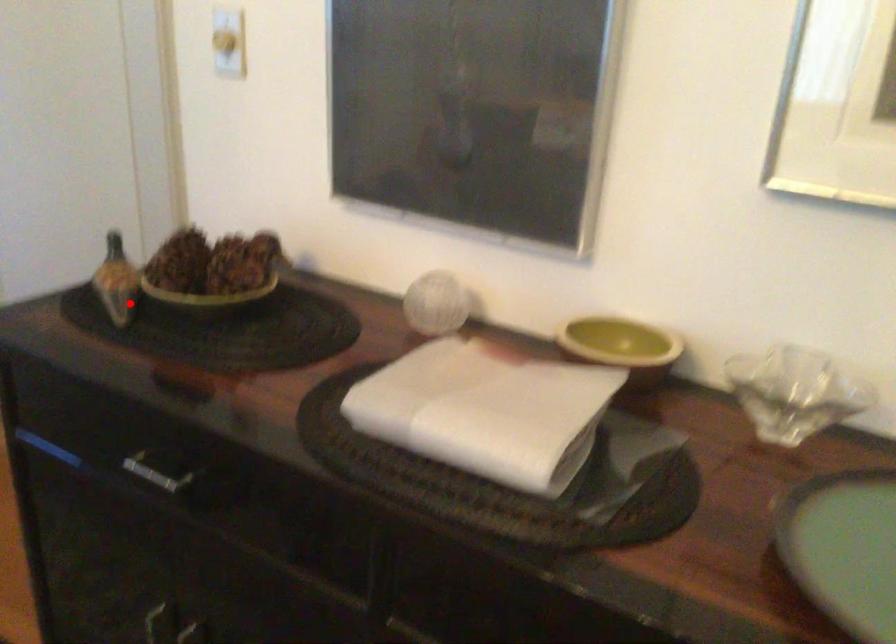
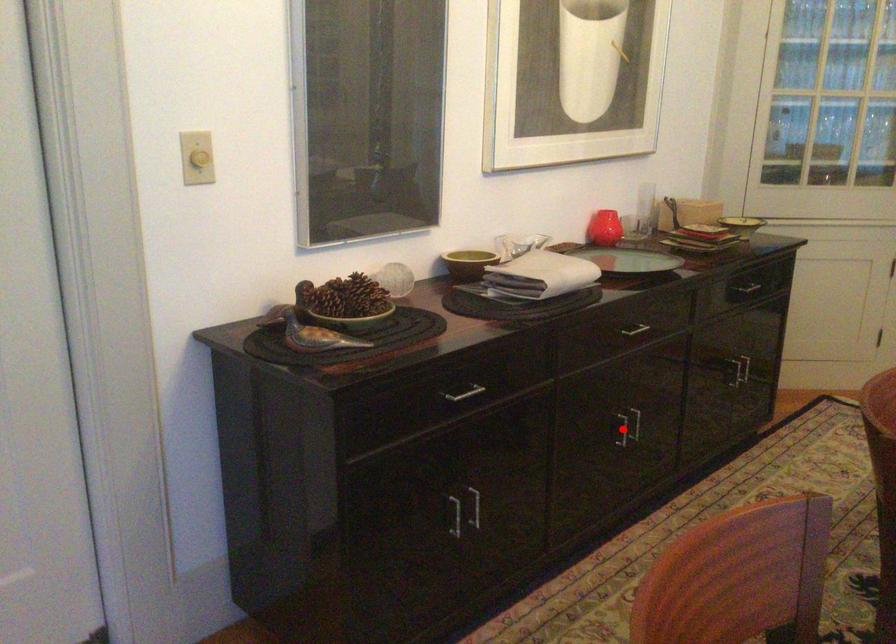
I am providing you with two images of the same scene from different viewpoints. A red point is marked on the first image and another point is marked on the second image. Is the marked point in image1 the same physical position as the marked point in image2?

No